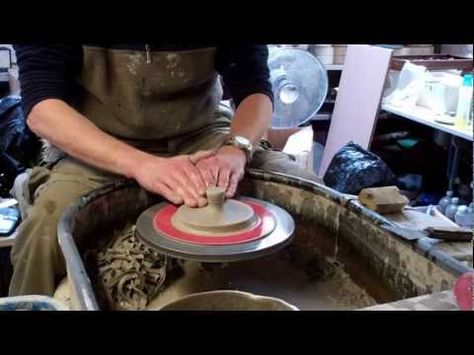
You are a GUI agent. You are given a task and a screenshot of the screen. Output one action in this format:
    pyautogui.click(x=<x>, y=<y>)
    Task: Click on the fan
    
    Given the screenshot: What is the action you would take?
    pyautogui.click(x=309, y=76)